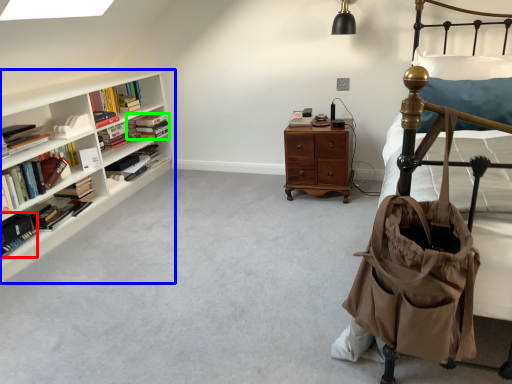
Question: Which object is positioned farthest from book (highlighted by a red box)? Select from shelf (highlighted by a blue box) and book (highlighted by a green box).

Choices:
 (A) shelf
 (B) book

Answer: (B)